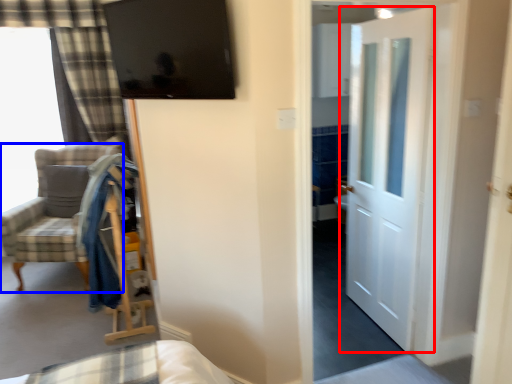
Question: Which point is further to the camera, door (highlighted by a red box) or chair (highlighted by a blue box)?

Choices:
 (A) door
 (B) chair

Answer: (B)